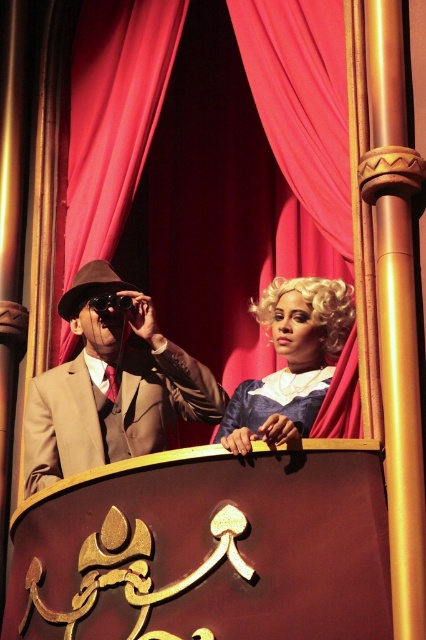
Question: Does red velvet curtain at upper center appear on the left side of blonde wig at center?

Choices:
 (A) no
 (B) yes

Answer: (B)

Question: Among these objects, which one is nearest to the camera?

Choices:
 (A) matte brown suit at left
 (B) blonde wig at center
 (C) red velvet curtain at upper center
 (D) blonde curly wig at upper right

Answer: (B)

Question: Does matte brown suit at left appear on the left side of blonde curly wig at upper right?

Choices:
 (A) no
 (B) yes

Answer: (B)

Question: Can you confirm if matte brown suit at left is positioned to the left of blonde wig at center?

Choices:
 (A) no
 (B) yes

Answer: (B)

Question: Which object appears farthest from the camera in this image?

Choices:
 (A) blonde wig at center
 (B) matte brown suit at left
 (C) blonde curly wig at upper right
 (D) red velvet curtain at upper center

Answer: (B)

Question: Which object appears closest to the camera in this image?

Choices:
 (A) red velvet curtain at upper center
 (B) blonde wig at center

Answer: (B)